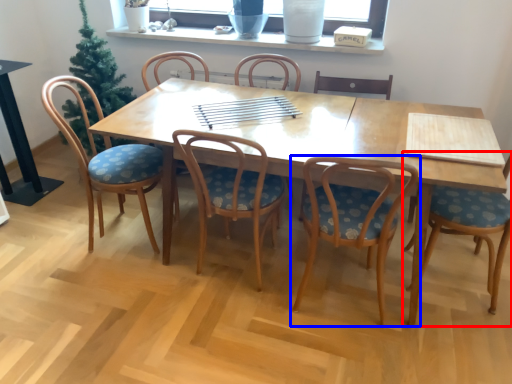
Question: Among these objects, which one is farthest to the camera, chair (highlighted by a red box) or chair (highlighted by a blue box)?

Choices:
 (A) chair
 (B) chair

Answer: (A)